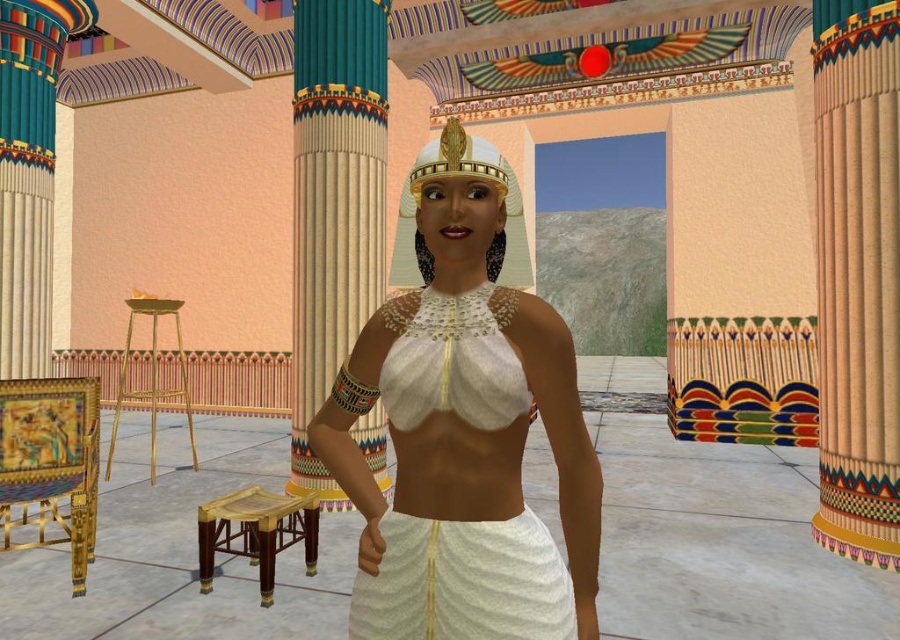
You are an archaeologist standing in the ancient Egyptian temple. You notice two points marked in the scene. The first point is at coordinates point (554,449) and the second is at point (493,147). Which point is closer to you?

Point (554,449) is in front of point (493,147), so it is closer to you.

You are an archaeologist examining the ancient Egyptian interior. You notice the white glossy headdress at center and the gold metallic stool at left. Which object is positioned in front of the other?

The white glossy headdress at center is closer to the viewer than the gold metallic stool at left, so it is positioned in front of the stool.